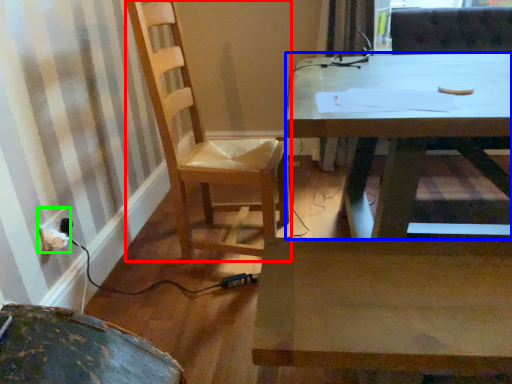
Question: Estimate the real-world distances between objects in this image. Which object is farther from chair (highlighted by a red box), desk (highlighted by a blue box) or electric outlet (highlighted by a green box)?

Choices:
 (A) desk
 (B) electric outlet

Answer: (B)